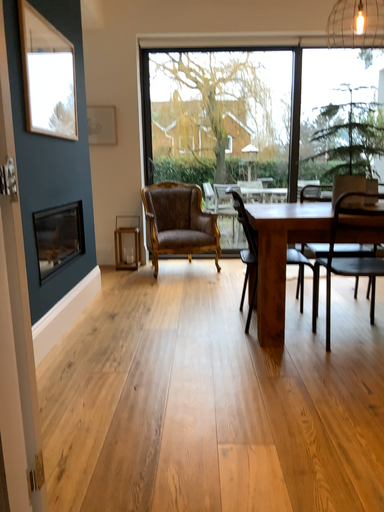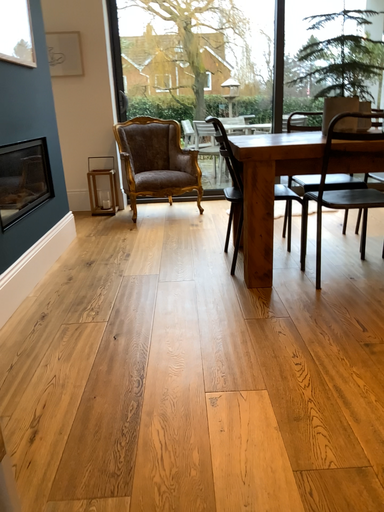
Question: Which way did the camera rotate in the video?

Choices:
 (A) rotated upward
 (B) rotated downward

Answer: (B)